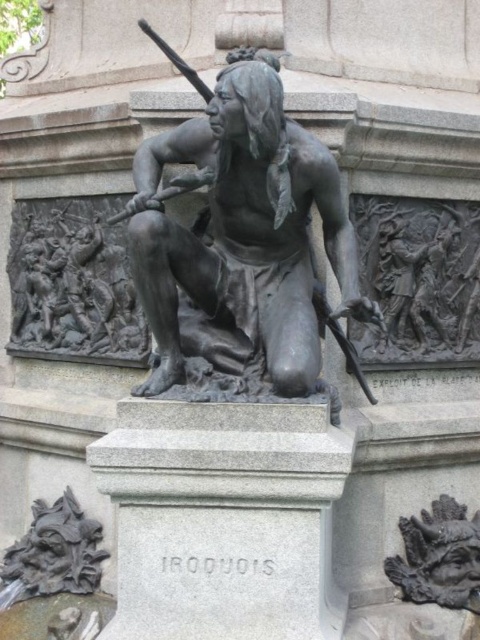
Question: Among these objects, which one is farthest from the camera?

Choices:
 (A) dark gray bas-relief battle scene at lower left
 (B) dark gray stone carving at lower left
 (C) dark gray stone carving at lower right

Answer: (A)

Question: Does bronze statue at center have a larger size compared to dark gray bas-relief battle scene at lower left?

Choices:
 (A) yes
 (B) no

Answer: (A)

Question: Which of the following is the closest to the observer?

Choices:
 (A) (297, 225)
 (B) (462, 592)

Answer: (A)

Question: Can you confirm if bronze statue at center is positioned to the right of dark gray stone carving at lower right?

Choices:
 (A) yes
 (B) no

Answer: (B)

Question: Considering the real-world distances, which object is farthest from the bronze statue at center?

Choices:
 (A) dark gray stone carving at lower left
 (B) dark gray stone carving at lower right

Answer: (A)

Question: Is dark gray bas-relief battle scene at lower left positioned in front of dark gray stone carving at lower left?

Choices:
 (A) yes
 (B) no

Answer: (B)